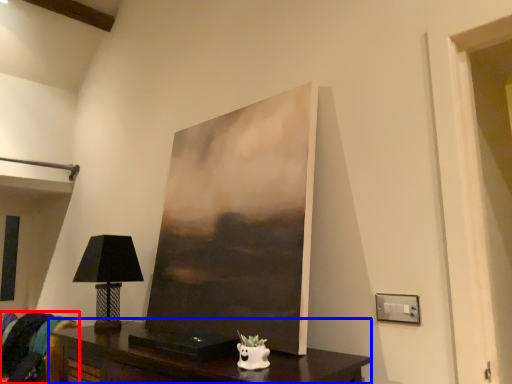
Question: Which of the following is the closest to the observer, swivel chair (highlighted by a red box) or table (highlighted by a blue box)?

Choices:
 (A) swivel chair
 (B) table

Answer: (B)